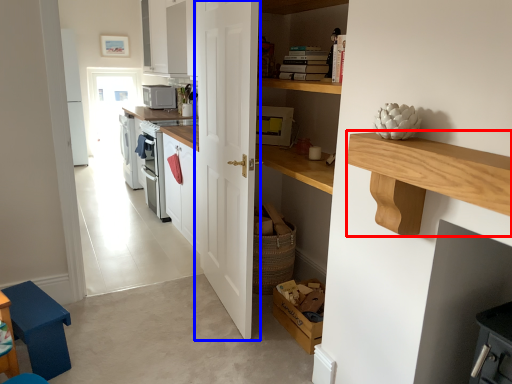
Question: Which point is further to the camera, counter (highlighted by a red box) or door (highlighted by a blue box)?

Choices:
 (A) counter
 (B) door

Answer: (B)